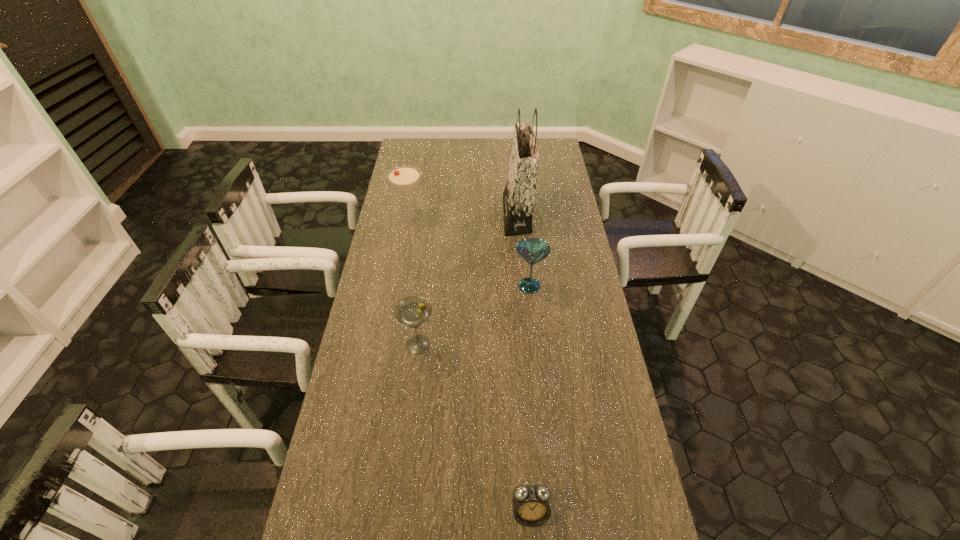
I want to click on free spot located 0.250m on the right of the farthest martini, so click(x=487, y=218).

The height and width of the screenshot is (540, 960). Find the location of `free space located 0.090m on the left of the second nearest object`. free space located 0.090m on the left of the second nearest object is located at coordinates (372, 345).

Where is `vacant space located on the front of the second farthest martini`? The height and width of the screenshot is (540, 960). vacant space located on the front of the second farthest martini is located at coordinates (533, 321).

Find the location of a particular element. This screenshot has height=540, width=960. vacant space at the far edge is located at coordinates (501, 139).

The height and width of the screenshot is (540, 960). In the image, there is a desktop. In order to click on vacant space at the left edge in this screenshot , I will do `click(386, 331)`.

Find the location of a particular element. This screenshot has width=960, height=540. vacant region at the right edge of the desktop is located at coordinates (555, 235).

Where is `vacant space at the far right corner`? Image resolution: width=960 pixels, height=540 pixels. vacant space at the far right corner is located at coordinates (551, 156).

Find the location of a particular element. This screenshot has width=960, height=540. vacant point located between the alarm clock and the second farthest martini is located at coordinates (530, 399).

The image size is (960, 540). What are the coordinates of `vacant point located between the farthest martini and the nearest martini` in the screenshot? It's located at (414, 281).

In order to click on free space between the tallest object and the nearest martini in this screenshot , I will do `click(468, 280)`.